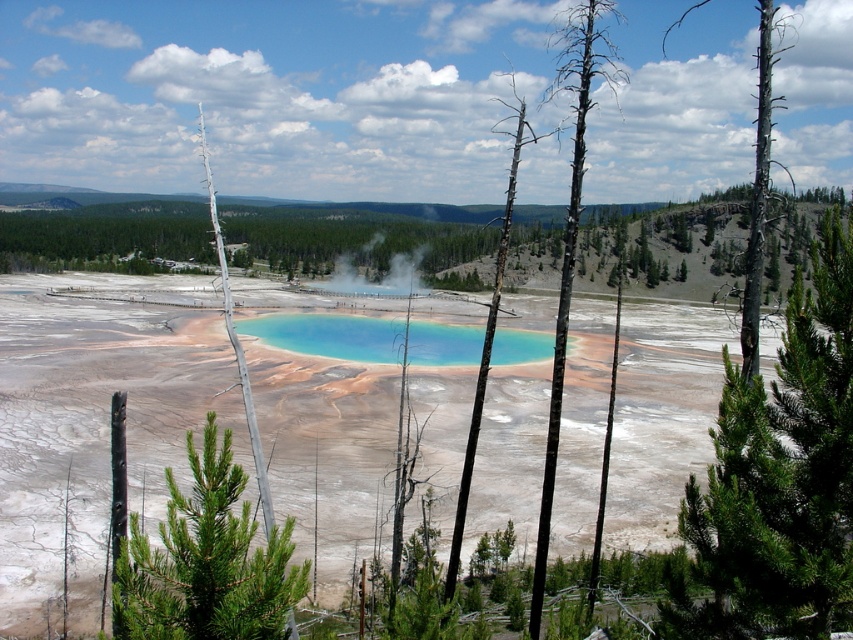
Between charred wood tree at center and black bark tree at center, which one has less height?

black bark tree at center

Between point (614, 83) and point (509, 170), which one is positioned behind?

Point (614, 83)

The image size is (853, 640). I want to click on charred wood tree at center, so click(569, 236).

Between turquoise glass pool at center and charred wood tree trunk at upper right, which one appears on the right side from the viewer's perspective?

charred wood tree trunk at upper right

Who is more distant from viewer, (352, 332) or (764, 77)?

Point (352, 332)

Image resolution: width=853 pixels, height=640 pixels. What do you see at coordinates (329, 336) in the screenshot? I see `turquoise glass pool at center` at bounding box center [329, 336].

Locate an element on the screen. Image resolution: width=853 pixels, height=640 pixels. turquoise glass pool at center is located at coordinates (329, 336).

Who is higher up, green needle-like tree at center-right or turquoise glass pool at center?

turquoise glass pool at center

Does point (788, 502) lie behind point (322, 317)?

No, (788, 502) is closer to viewer.

Find the location of `green needle-like tree at center-right`. green needle-like tree at center-right is located at coordinates (779, 477).